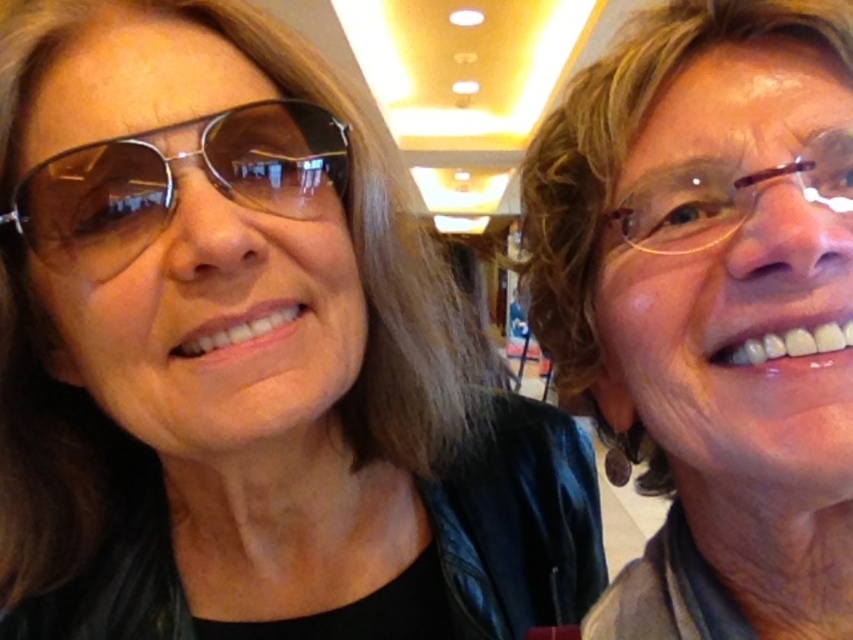
Question: Which point is farther from the camera taking this photo?

Choices:
 (A) (326, 394)
 (B) (558, 278)
 (C) (735, 198)
 (D) (172, 211)

Answer: (B)

Question: Does matte black sunglasses at upper left appear over brown plastic glasses at right?

Choices:
 (A) no
 (B) yes

Answer: (A)

Question: In this image, where is matte black sunglasses at upper left located relative to brown plastic glasses at right?

Choices:
 (A) above
 (B) below

Answer: (B)

Question: Which point appears closest to the camera in this image?

Choices:
 (A) (30, 42)
 (B) (335, 177)

Answer: (A)

Question: Among these objects, which one is nearest to the camera?

Choices:
 (A) matte black jacket at right
 (B) sunglasses at left
 (C) matte black sunglasses at upper left

Answer: (A)

Question: Is matte black jacket at right wider than sunglasses at left?

Choices:
 (A) no
 (B) yes

Answer: (A)